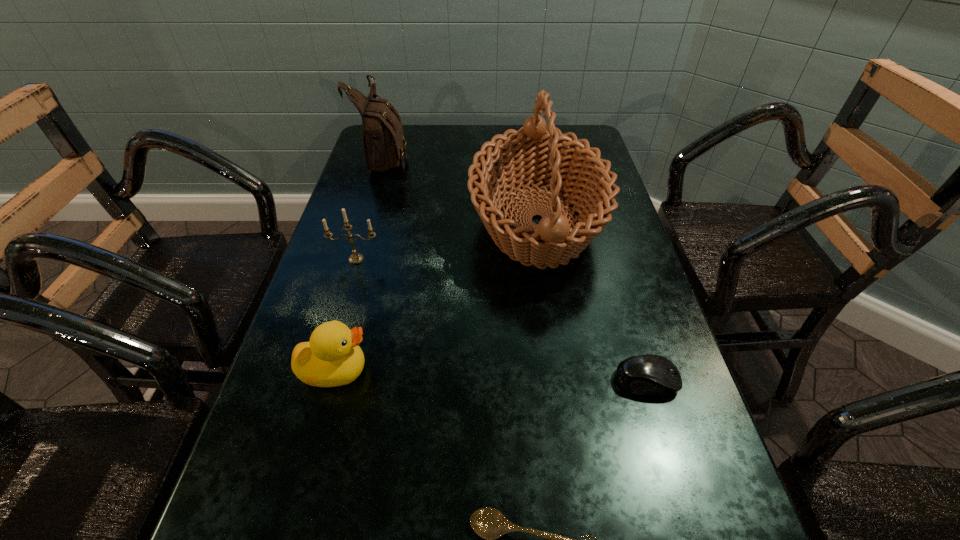
I want to click on object located at the far edge, so click(384, 144).

The height and width of the screenshot is (540, 960). What are the coordinates of `shoulder bag present at the left edge` in the screenshot? It's located at (384, 144).

Locate an element on the screen. candle positioned at the left edge is located at coordinates (355, 258).

The height and width of the screenshot is (540, 960). I want to click on duck positioned at the left edge, so click(332, 357).

Identify the location of basket that is positioned at the right edge. (536, 154).

I want to click on mouse present at the right edge, so click(x=646, y=374).

Locate an element on the screen. The width and height of the screenshot is (960, 540). object at the far left corner is located at coordinates [x=384, y=144].

This screenshot has width=960, height=540. I want to click on blank space at the far edge of the desktop, so click(440, 158).

The height and width of the screenshot is (540, 960). Find the location of `vacant space at the left edge of the desktop`. vacant space at the left edge of the desktop is located at coordinates (320, 308).

Where is `free spot at the right edge of the desktop`? The width and height of the screenshot is (960, 540). free spot at the right edge of the desktop is located at coordinates (612, 238).